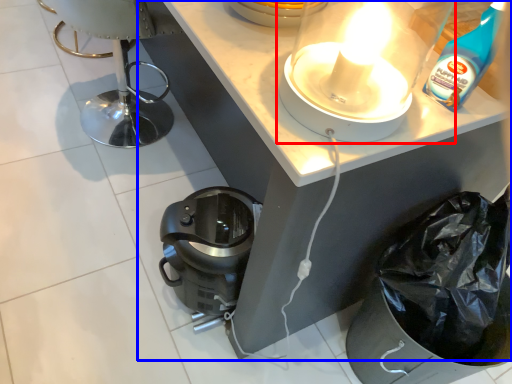
Question: Which point is further to the camera, kitchen appliance (highlighted by a red box) or vanity (highlighted by a blue box)?

Choices:
 (A) kitchen appliance
 (B) vanity

Answer: (B)